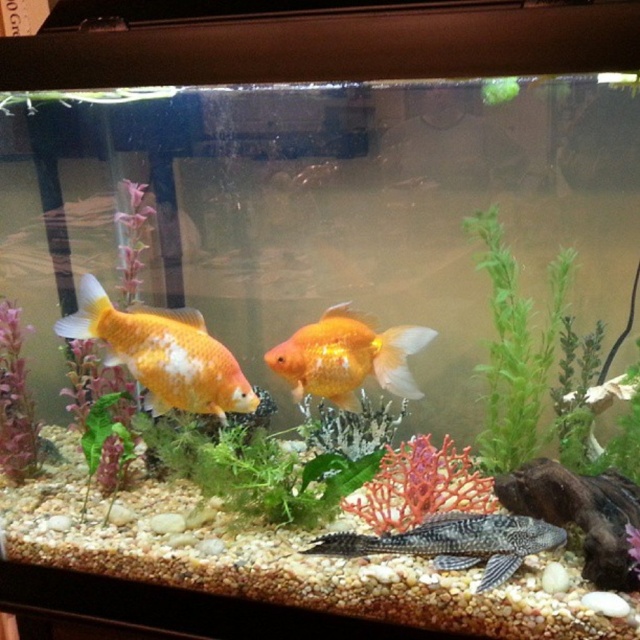
Question: Among these points, which one is farthest from the camera?

Choices:
 (A) (496, 525)
 (B) (388, 356)
 (C) (20, 456)

Answer: (C)

Question: Among these objects, which one is nearest to the camera?

Choices:
 (A) goldfish at center
 (B) green leafy plant at center

Answer: (A)

Question: Does matte purple plant at left have a smaller size compared to green leafy plant at center?

Choices:
 (A) no
 (B) yes

Answer: (A)

Question: Can you confirm if goldfish at center is smaller than black matte fish at bottom?

Choices:
 (A) no
 (B) yes

Answer: (A)

Question: Does goldfish at center have a smaller size compared to matte purple plant at left?

Choices:
 (A) no
 (B) yes

Answer: (B)

Question: Among these points, which one is farthest from the camera?

Choices:
 (A) (490, 518)
 (B) (198, 403)
 (C) (406, 353)
 (D) (102, 422)

Answer: (D)